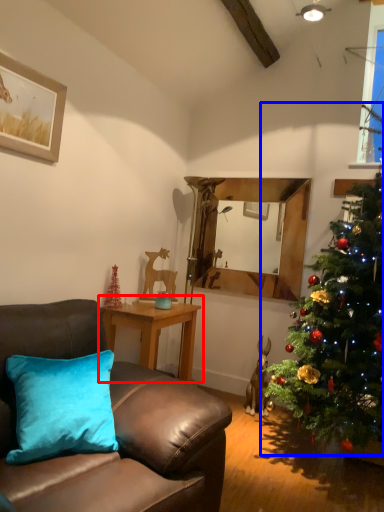
Question: Which object appears closest to the camera in this image, table (highlighted by a red box) or christmas tree (highlighted by a blue box)?

Choices:
 (A) table
 (B) christmas tree

Answer: (B)